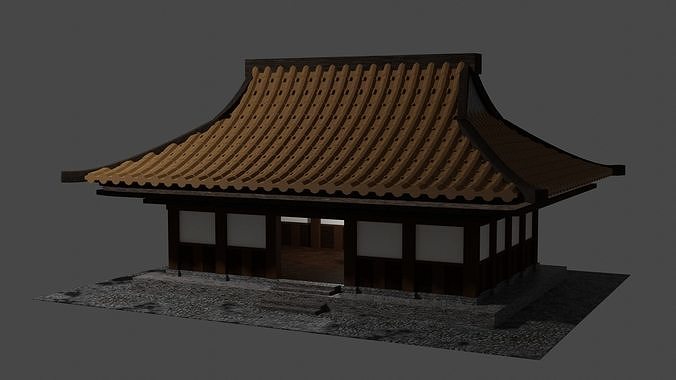
Where is `window`? Image resolution: width=676 pixels, height=380 pixels. window is located at coordinates (193, 225), (245, 231), (391, 235), (433, 243), (485, 244), (501, 239), (514, 235), (530, 227).